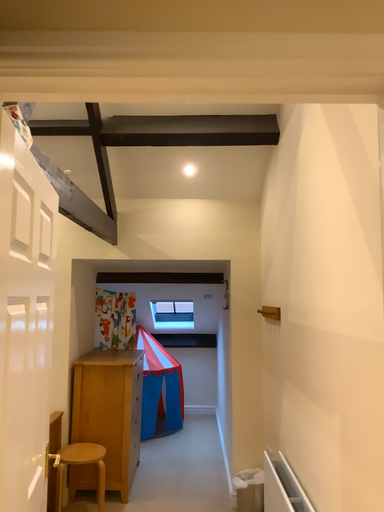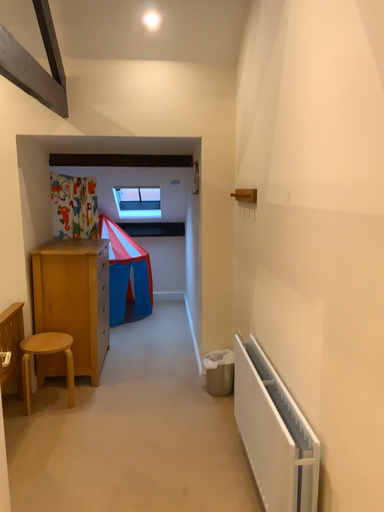
Question: How did the camera likely rotate when shooting the video?

Choices:
 (A) rotated upward
 (B) rotated downward

Answer: (B)